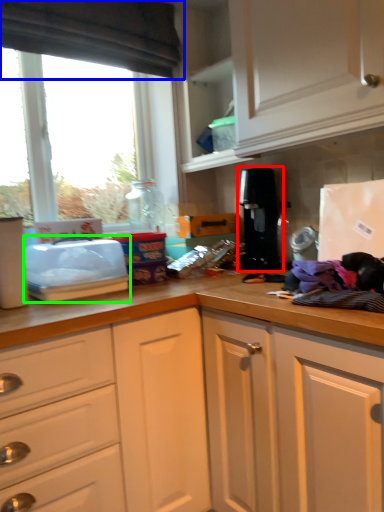
Question: Which object is positioned farthest from coffee machine (highlighted by a red box)? Select from exhaust hood (highlighted by a blue box) and appliance (highlighted by a green box).

Choices:
 (A) exhaust hood
 (B) appliance

Answer: (A)